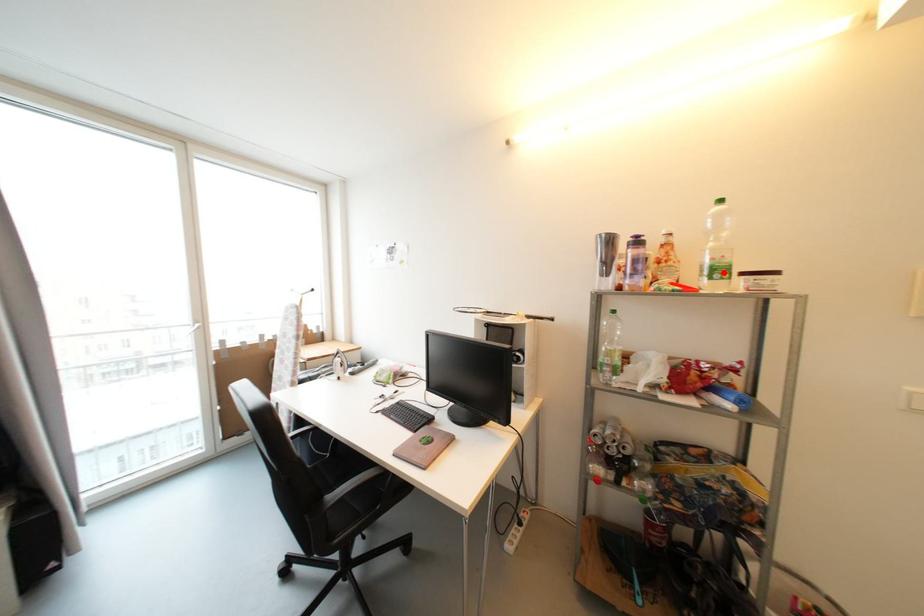
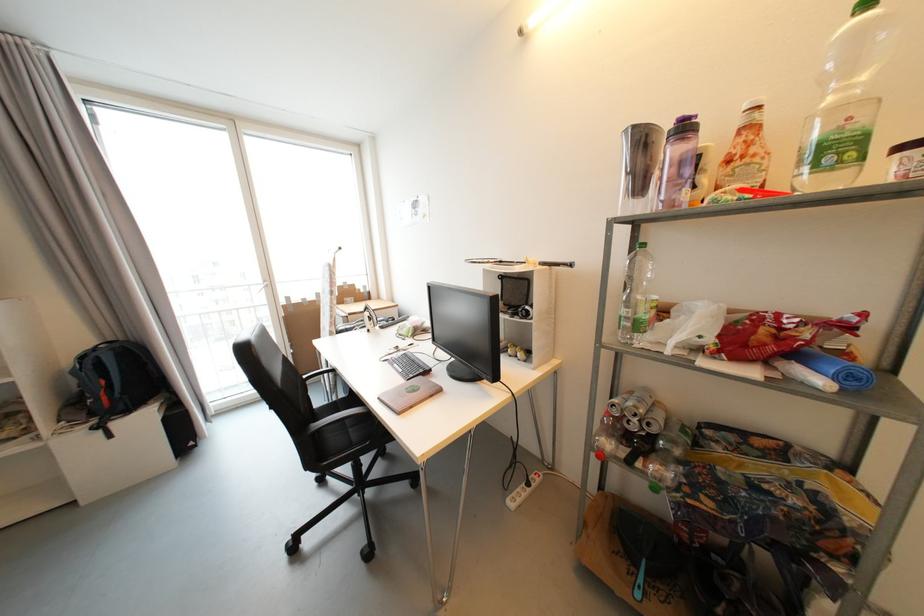
Find the pixel in the second image that matches the highlighted location in the first image.

(842, 151)